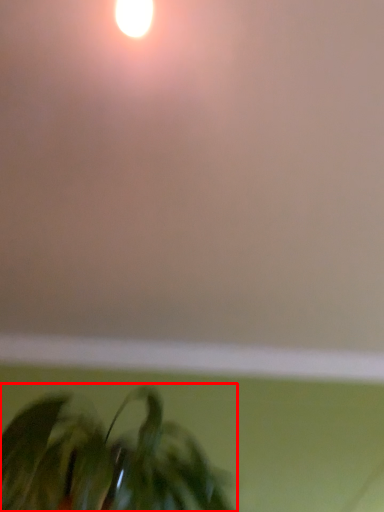
Question: Observing the image, what is the correct spatial positioning of houseplant (annotated by the red box) in reference to backdrop?

Choices:
 (A) right
 (B) left

Answer: (B)